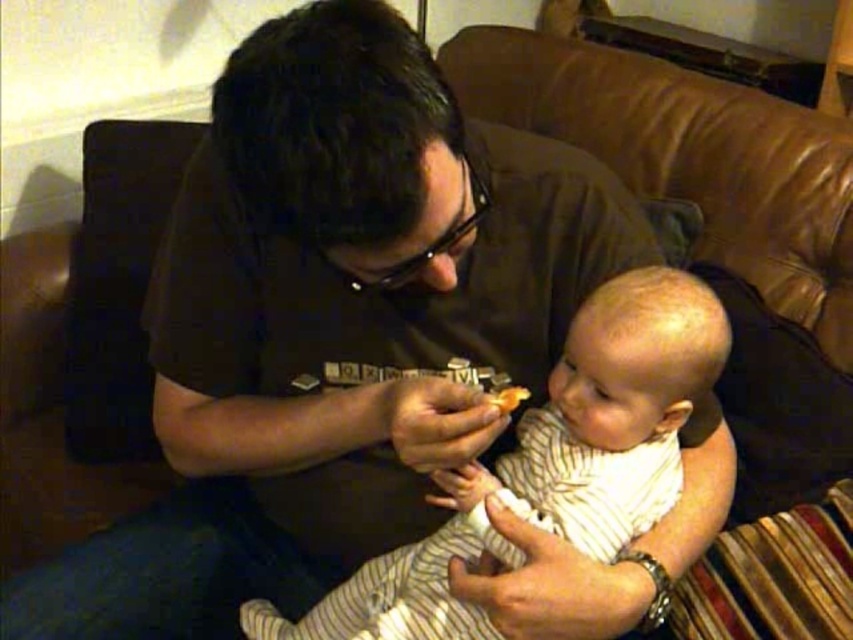
Does point (479, 612) come behind point (500, 408)?

Yes, point (479, 612) is farther from viewer.

Is striped cotton onesie at center above yellow matte cookie at center?

No, striped cotton onesie at center is not above yellow matte cookie at center.

Is point (612, 426) positioned behind point (526, 388)?

No.

I want to click on striped cotton onesie at center, so click(550, 465).